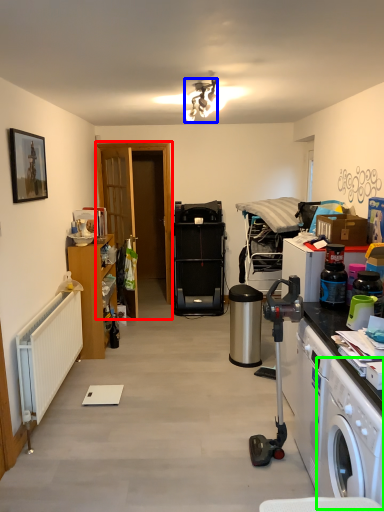
Question: Which object is the closest to the door (highlighted by a red box)? Choose among these: lamp (highlighted by a blue box) or washing machine (highlighted by a green box).

Choices:
 (A) lamp
 (B) washing machine

Answer: (A)